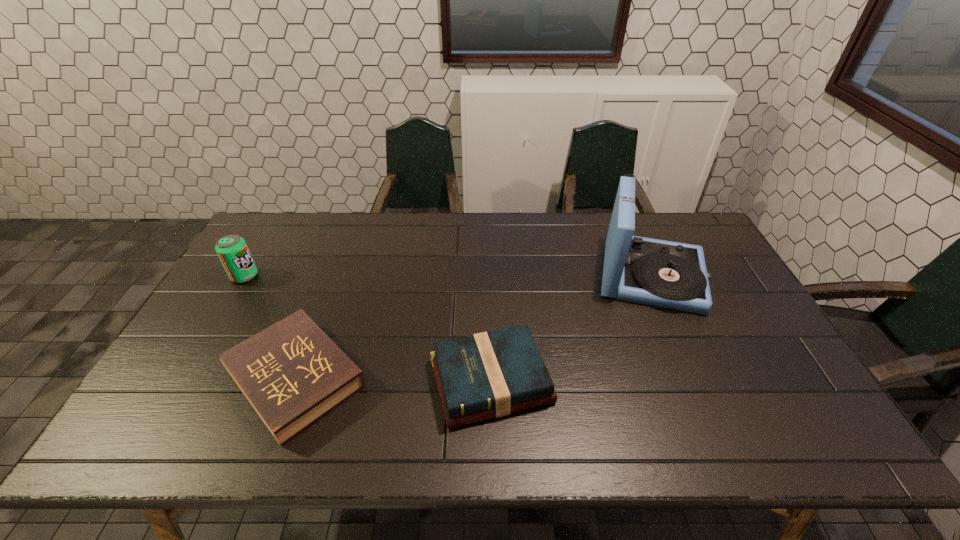
The width and height of the screenshot is (960, 540). Find the location of `free location at the right edge`. free location at the right edge is located at coordinates (759, 403).

Locate an element on the screen. This screenshot has height=540, width=960. blank space at the far left corner is located at coordinates (297, 234).

At what (x,y) coordinates should I click in order to perform the action: click on vacant area at the near left corner. Please return your answer as a coordinate pair (x, y). This screenshot has width=960, height=540. Looking at the image, I should click on (132, 424).

The width and height of the screenshot is (960, 540). What are the coordinates of `free space at the far right corner` in the screenshot? It's located at (704, 238).

Find the location of a particular element. free space between the second object from right to left and the pop soda is located at coordinates pyautogui.click(x=368, y=329).

At what (x,y) coordinates should I click in order to perform the action: click on vacant point located between the leftmost object and the right hardback book. Please return your answer as a coordinate pair (x, y). Looking at the image, I should click on (368, 329).

The height and width of the screenshot is (540, 960). I want to click on free area in between the second object from left to right and the third object from left to right, so click(394, 380).

Identify the location of free spot between the right hardback book and the rightmost object. This screenshot has height=540, width=960. (571, 328).

This screenshot has width=960, height=540. Find the location of `free point between the phonograph record and the second object from left to right`. free point between the phonograph record and the second object from left to right is located at coordinates (473, 327).

The height and width of the screenshot is (540, 960). Find the location of `free space between the leftmost object and the phonograph record`. free space between the leftmost object and the phonograph record is located at coordinates (448, 276).